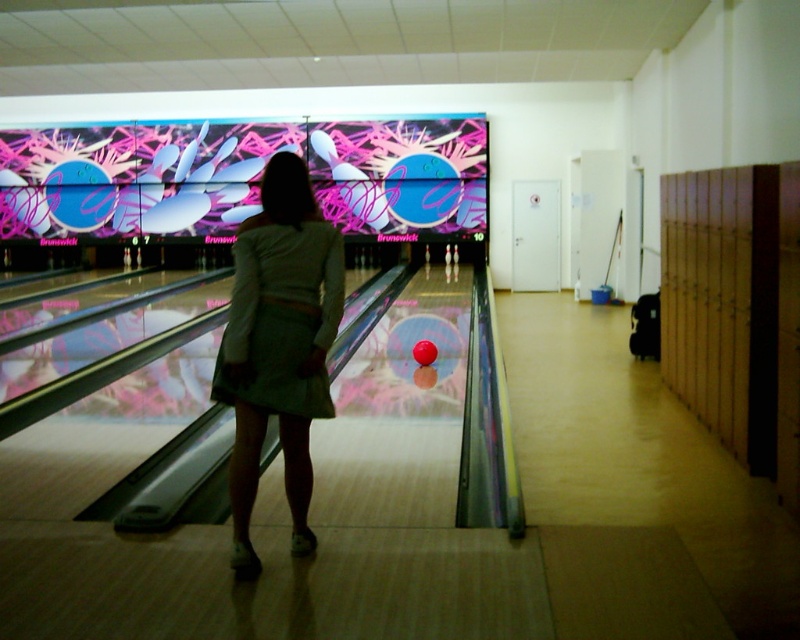
You are a photographer trying to capture the perfect shot of the white cotton dress at center. To do this, you need to position yourself exactly at the coordinates provided in the description. What are the coordinates where you should stand to capture the dress perfectly?

The coordinates for the white cotton dress at center are at point (x=278, y=344). You should position yourself at those coordinates to capture the dress perfectly.

You are a photographer trying to capture a closeup of the white cotton dress at center and the green fabric dress at center. Can you fit both dresses into your camera frame that has a 3 inch width capacity?

The white cotton dress at center is 3.33 inches away from green fabric dress at center, so no, the camera frame with a 3 inch width capacity cannot fit both dresses as the distance between them exceeds the frame size.